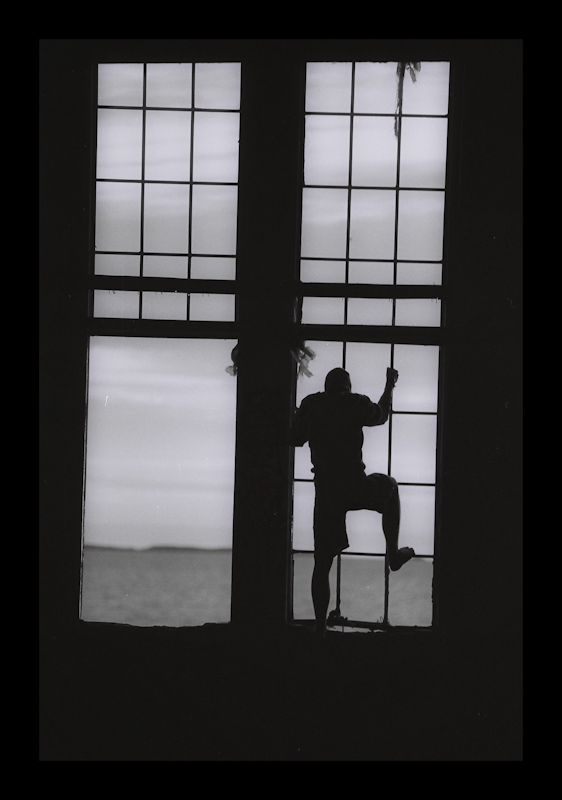
Locate an element on the screen. lower left window is located at coordinates (172, 573).